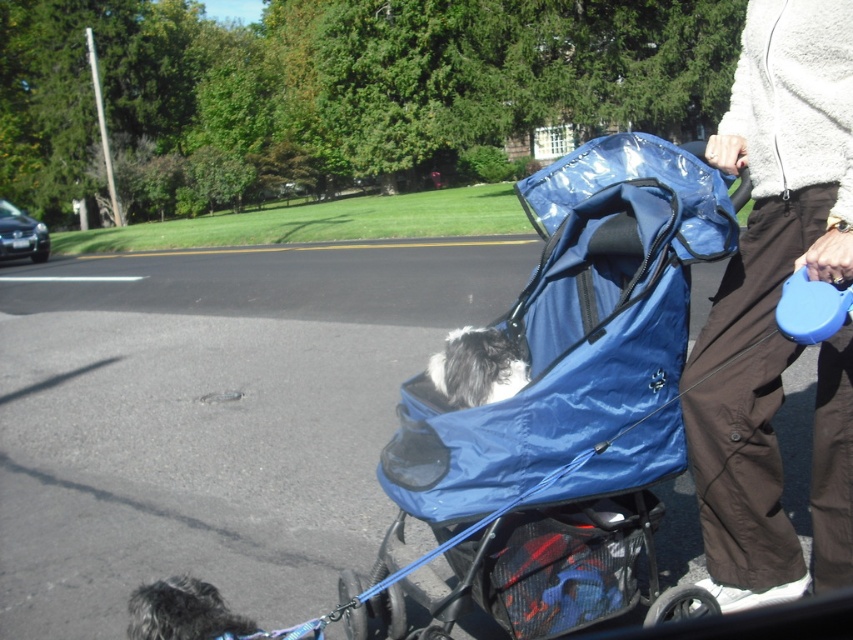
Question: Among these points, which one is nearest to the camera?

Choices:
 (A) [138, 596]
 (B) [490, 340]
 (C) [608, 484]
 (D) [827, 221]

Answer: (D)

Question: Which of these objects is positioned farthest from the blue glossy stroller at center?

Choices:
 (A) fluffy gray dog in stroller at center
 (B) brown cotton pants at right
 (C) shaggy fur dog at lower left

Answer: (C)

Question: Observing the image, what is the correct spatial positioning of blue glossy stroller at center in reference to brown cotton pants at right?

Choices:
 (A) left
 (B) right

Answer: (A)

Question: Does blue glossy stroller at center lie in front of brown cotton pants at right?

Choices:
 (A) yes
 (B) no

Answer: (B)

Question: Which point appears farthest from the camera in this image?

Choices:
 (A) (157, 595)
 (B) (755, 371)
 (C) (466, 372)
 (D) (577, 538)

Answer: (D)

Question: Does brown cotton pants at right appear on the left side of fluffy gray dog in stroller at center?

Choices:
 (A) yes
 (B) no

Answer: (B)